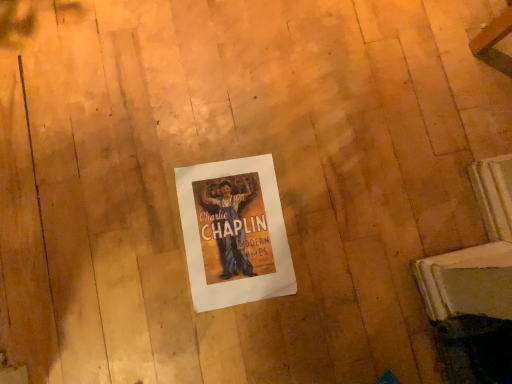
Where is `free space below white paper poster at center (from a real-world perspective)`? The image size is (512, 384). free space below white paper poster at center (from a real-world perspective) is located at coordinates (238, 236).